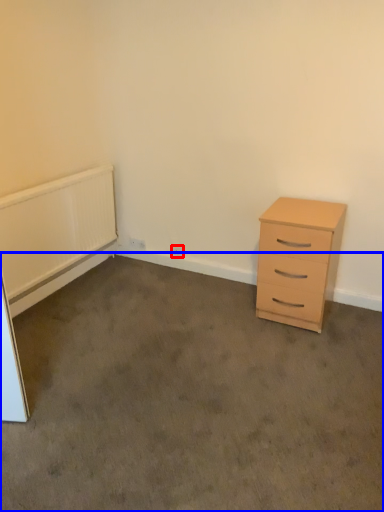
Question: Which point is closer to the camera, electric outlet (highlighted by a red box) or plain (highlighted by a blue box)?

Choices:
 (A) electric outlet
 (B) plain

Answer: (B)